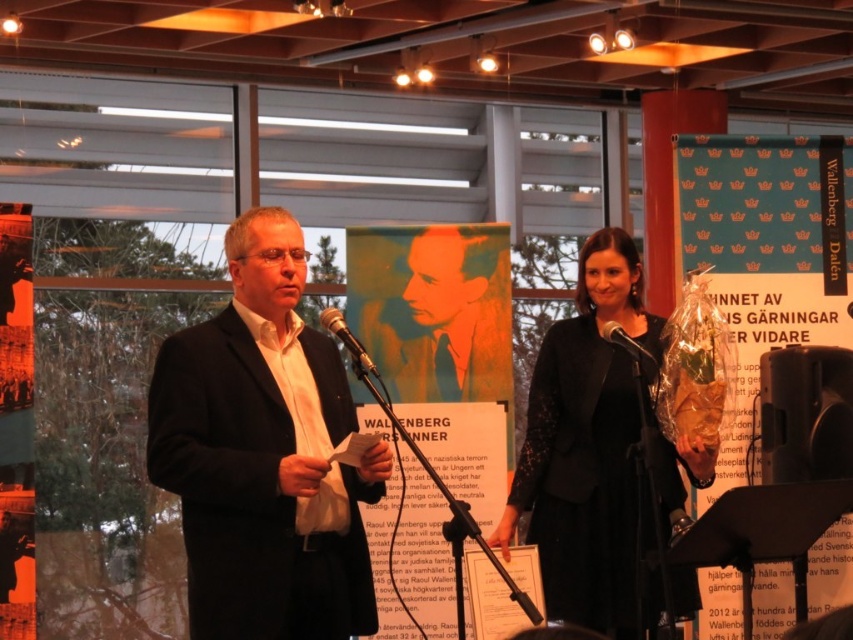
Question: Does black lace dress at center lie in front of black matte microphone at center?

Choices:
 (A) yes
 (B) no

Answer: (A)

Question: Is matte black suit at center thinner than black lace dress at center?

Choices:
 (A) yes
 (B) no

Answer: (A)

Question: Which of the following is the closest to the observer?

Choices:
 (A) (351, 337)
 (B) (614, 324)
 (C) (16, 515)
 (D) (738, 156)

Answer: (A)

Question: Can you confirm if white paper at center is positioned to the left of matte black poster at upper center?

Choices:
 (A) yes
 (B) no

Answer: (B)

Question: Which point is closer to the camera taking this photo?

Choices:
 (A) (689, 241)
 (B) (270, 401)
 (C) (631, 522)

Answer: (B)

Question: Which of the following is the farthest from the observer?

Choices:
 (A) black plastic microphone at center
 (B) matte black poster at upper center
 (C) green paper at upper right
 (D) black matte microphone at center

Answer: (C)